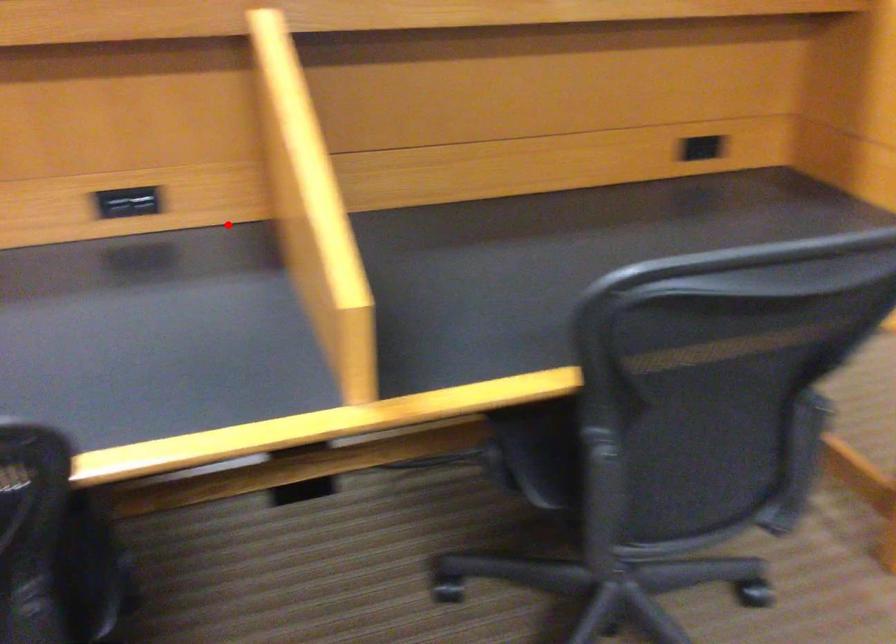
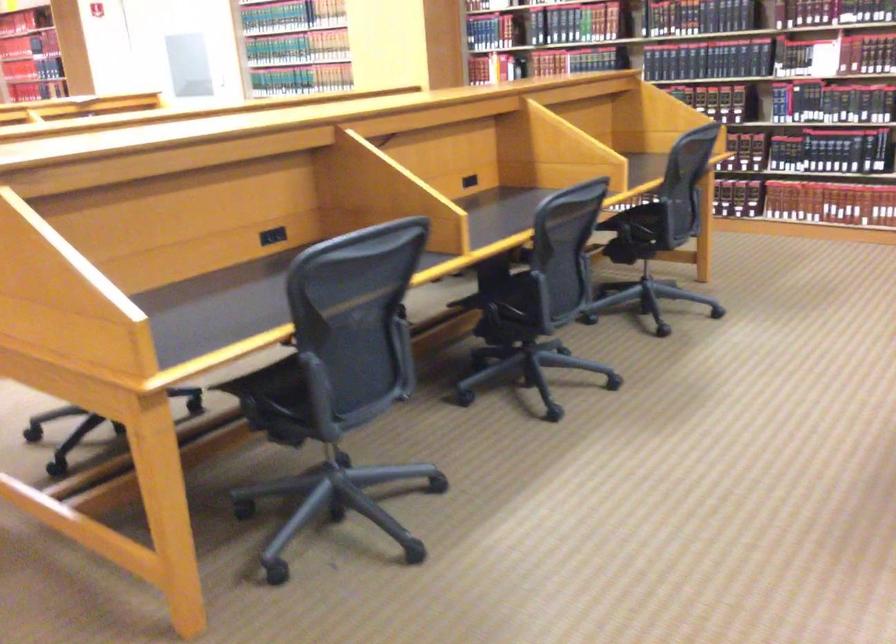
Question: I am providing you with two images of the same scene from different viewpoints. Given a red point in image1, look at the same physical point in image2. Is it:

Choices:
 (A) Closer to the viewpoint
 (B) Farther from the viewpoint

Answer: (B)